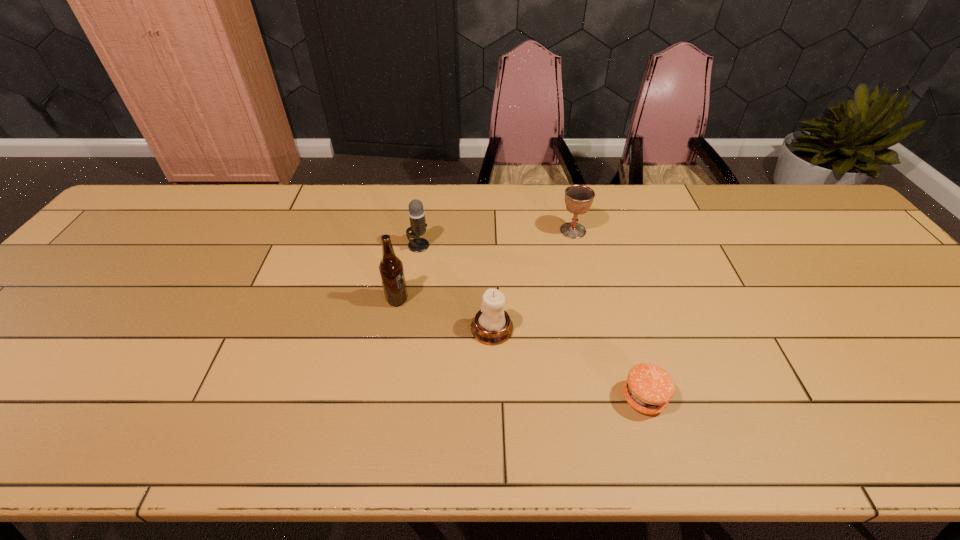
The height and width of the screenshot is (540, 960). Find the location of `the third nearest object`. the third nearest object is located at coordinates (391, 269).

The width and height of the screenshot is (960, 540). I want to click on beer bottle, so click(x=391, y=269).

Find the location of a particular element. microphone is located at coordinates (416, 213).

Where is `chalice`? chalice is located at coordinates (578, 198).

Find the location of a particular element. The width and height of the screenshot is (960, 540). candle holder is located at coordinates (492, 325).

Locate an element on the screen. The image size is (960, 540). the fourth farthest object is located at coordinates (492, 325).

Find the location of `the nearest object`. the nearest object is located at coordinates (648, 388).

Locate an element on the screen. the shortest object is located at coordinates (648, 388).

Locate an element on the screen. free point located 0.070m on the label of the tallest object is located at coordinates (435, 300).

Where is `vacant space situated 0.210m on the right of the microphone`? This screenshot has height=540, width=960. vacant space situated 0.210m on the right of the microphone is located at coordinates (501, 245).